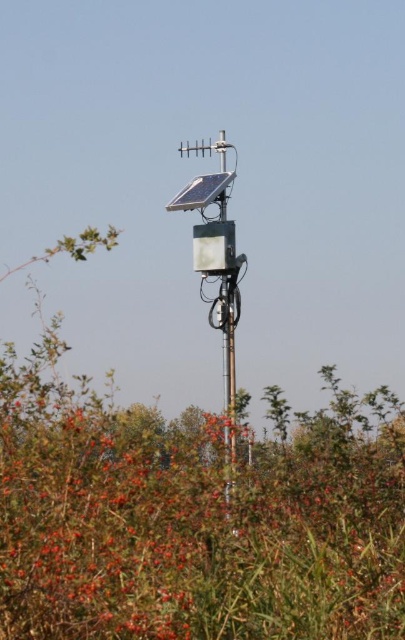
You are standing in front of the solar device and want to touch both the green leafy bush at center and the metallic pole at center. Which object should you reach for first?

The green leafy bush at center is closer to the viewer than the metallic pole at center, so you should reach for the green leafy bush at center first.

You are an engineer inspecting the solar device. From your current position, which object is closer to you between the metallic solar panel at center and the metallic pole at center?

The metallic solar panel at center is closer to you since it is further to the viewer than the metallic pole at center.